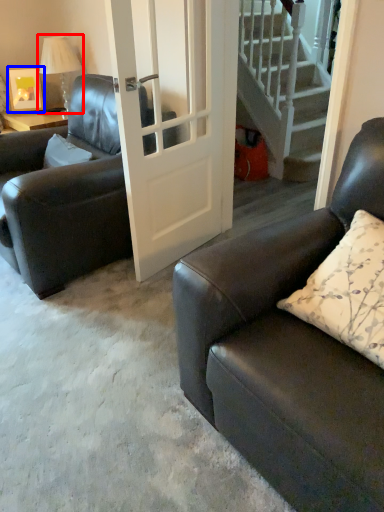
Question: Which object appears closest to the camera in this image, lamp (highlighted by a red box) or picture frame (highlighted by a blue box)?

Choices:
 (A) lamp
 (B) picture frame

Answer: (A)